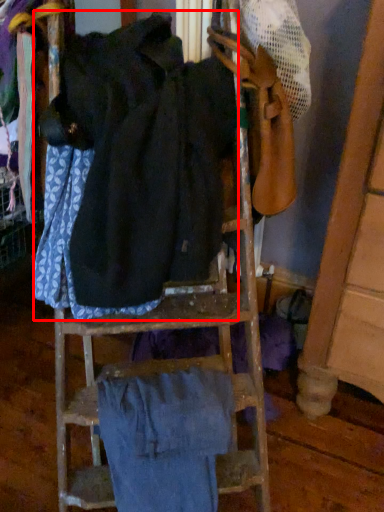
Question: Considering the relative positions of wide (annotated by the red box) and wide in the image provided, where is wide (annotated by the red box) located with respect to the staircase?

Choices:
 (A) right
 (B) left

Answer: (B)